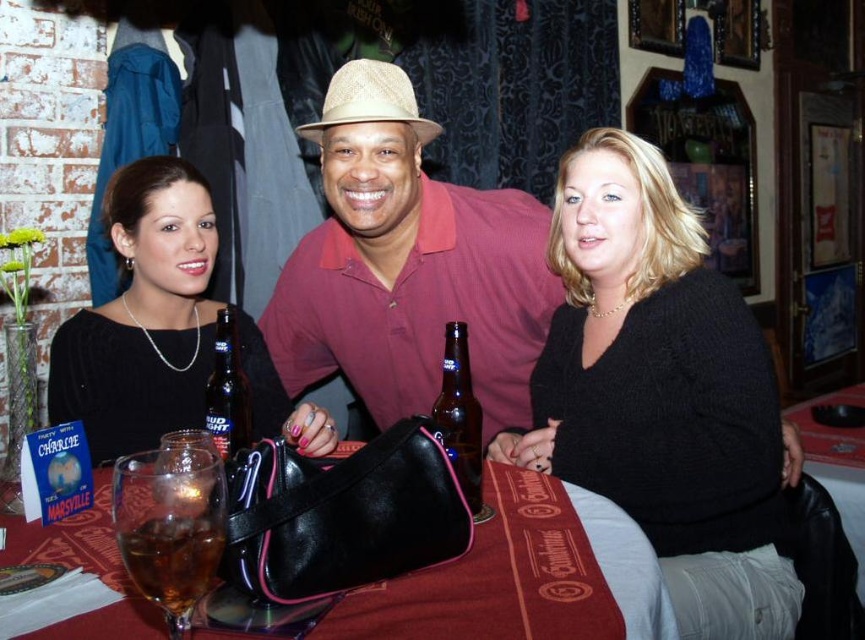
You are a waiter in this dining scene. You need to place a dessert plate that requires 12 inches of space. Which object between the brown liquid glass at lower left and the brown glass bottle at center should you move to make space?

The brown liquid glass at lower left has a larger width than the brown glass bottle at center, so moving the brown liquid glass at lower left would free up more space for the dessert plate.

You are standing in the dining area and want to place a 60 cm wide decorative plate at point (580, 620). Can the plate fit there?

The distance from you to point (580, 620) is 75.87 centimeters. Since the plate is 60 cm wide, it will fit as the space available is larger than the plate.